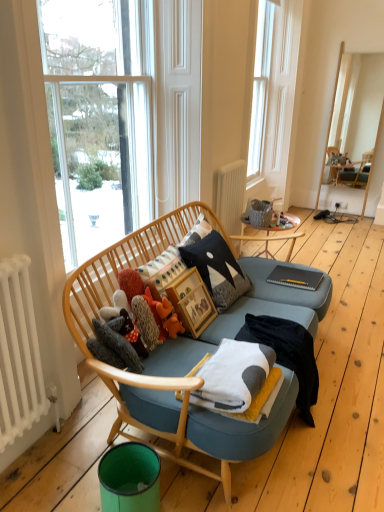
Question: From a real-world perspective, does white radiator at lower left, which is the first radiator in bottom-to-top order, stand above white soft blanket at center, arranged as the 1th blanket when viewed from the front?

Choices:
 (A) yes
 (B) no

Answer: (A)

Question: Is the depth of white radiator at lower left, which is the first radiator in bottom-to-top order, less than that of white soft blanket at center, which is the second blanket from back to front?

Choices:
 (A) no
 (B) yes

Answer: (B)

Question: Is white radiator at lower left, positioned as the 2th radiator in right-to-left order, in contact with white soft blanket at center, which is the second blanket from back to front?

Choices:
 (A) yes
 (B) no

Answer: (B)

Question: Is white soft blanket at center, which is the second blanket from back to front, at the back of white radiator at lower left, the 1th radiator viewed from the front?

Choices:
 (A) no
 (B) yes

Answer: (A)

Question: Is white radiator at lower left, which appears as the 2th radiator when viewed from the back, at the left side of white soft blanket at center, which is the second blanket from back to front?

Choices:
 (A) no
 (B) yes

Answer: (B)

Question: Is white painted radiator at center, the first radiator from the top, bigger or smaller than white soft blanket at center, which is the second blanket from back to front?

Choices:
 (A) big
 (B) small

Answer: (A)

Question: Is point (241, 186) positioned closer to the camera than point (203, 379)?

Choices:
 (A) closer
 (B) farther

Answer: (B)

Question: Is white painted radiator at center, positioned as the first radiator in right-to-left order, wider or thinner than white soft blanket at center, arranged as the 1th blanket when viewed from the front?

Choices:
 (A) thin
 (B) wide

Answer: (A)

Question: Is white painted radiator at center, placed as the 2th radiator when sorted from bottom to top, spatially inside white soft blanket at center, arranged as the 1th blanket when viewed from the front, or outside of it?

Choices:
 (A) inside
 (B) outside

Answer: (B)

Question: Would you say white radiator at lower left, which appears as the 2th radiator when viewed from the back, is to the left or to the right of slate gray notebook at center in the picture?

Choices:
 (A) right
 (B) left

Answer: (B)

Question: In the image, is white radiator at lower left, arranged as the first radiator when viewed from the left, positioned in front of or behind slate gray notebook at center?

Choices:
 (A) front
 (B) behind

Answer: (A)

Question: From the image's perspective, is white radiator at lower left, positioned as the 2th radiator in right-to-left order, positioned above or below slate gray notebook at center?

Choices:
 (A) above
 (B) below

Answer: (B)

Question: Looking at their shapes, would you say white radiator at lower left, which is the first radiator in bottom-to-top order, is wider or thinner than slate gray notebook at center?

Choices:
 (A) thin
 (B) wide

Answer: (A)

Question: Choose the correct answer: Is transparent glass window at upper center inside white soft blanket at center, which is the second blanket from front to back, or outside it?

Choices:
 (A) outside
 (B) inside

Answer: (A)

Question: From a real-world perspective, is transparent glass window at upper center positioned above or below white soft blanket at center, which is the first blanket from back to front?

Choices:
 (A) above
 (B) below

Answer: (A)